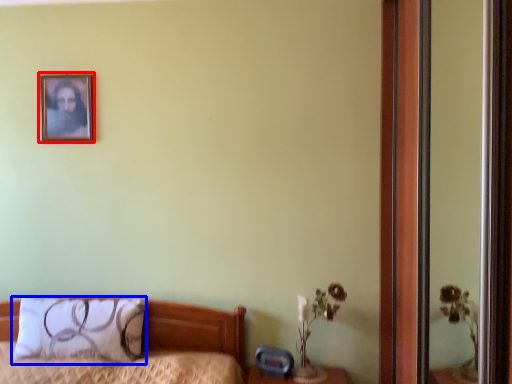
Question: Which object is closer to the camera taking this photo, picture frame (highlighted by a red box) or pillow (highlighted by a blue box)?

Choices:
 (A) picture frame
 (B) pillow

Answer: (B)